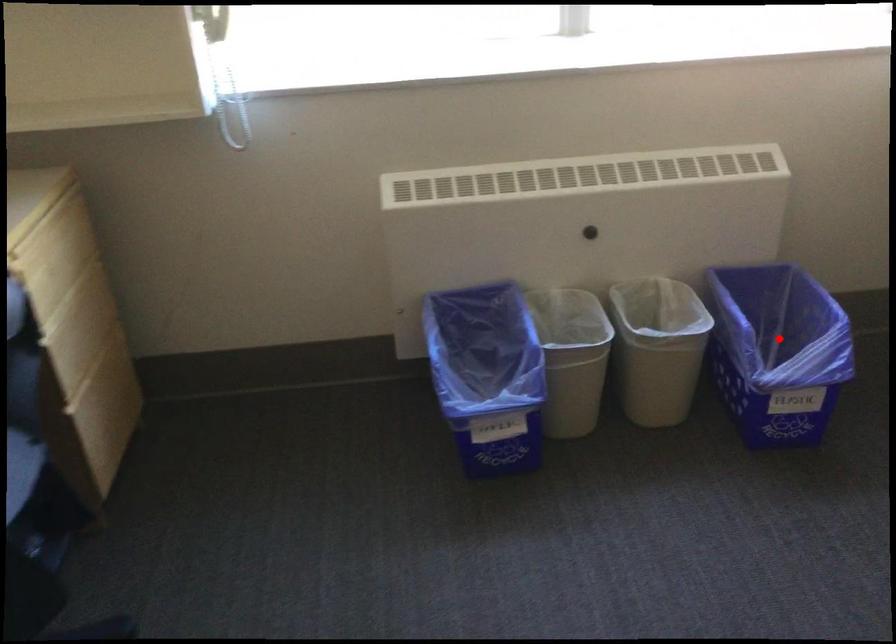
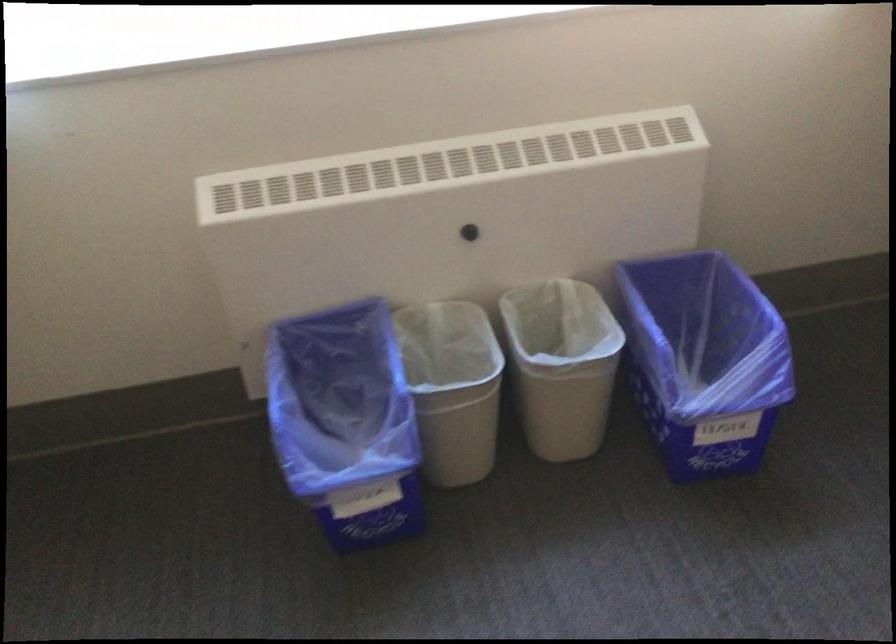
Question: I am providing you with two images of the same scene from different viewpoints. A red point is shown in image1. For the corresponding object point in image2, is it positioned nearer or farther from the camera?

Choices:
 (A) Nearer
 (B) Farther

Answer: (A)